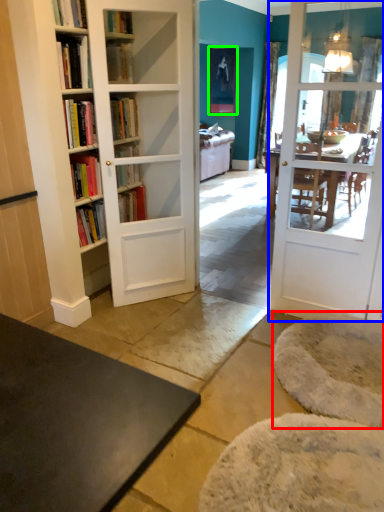
Question: Considering the real-world distances, which object is farthest from yoga mat (highlighted by a red box)? door (highlighted by a blue box) or picture frame (highlighted by a green box)?

Choices:
 (A) door
 (B) picture frame

Answer: (B)